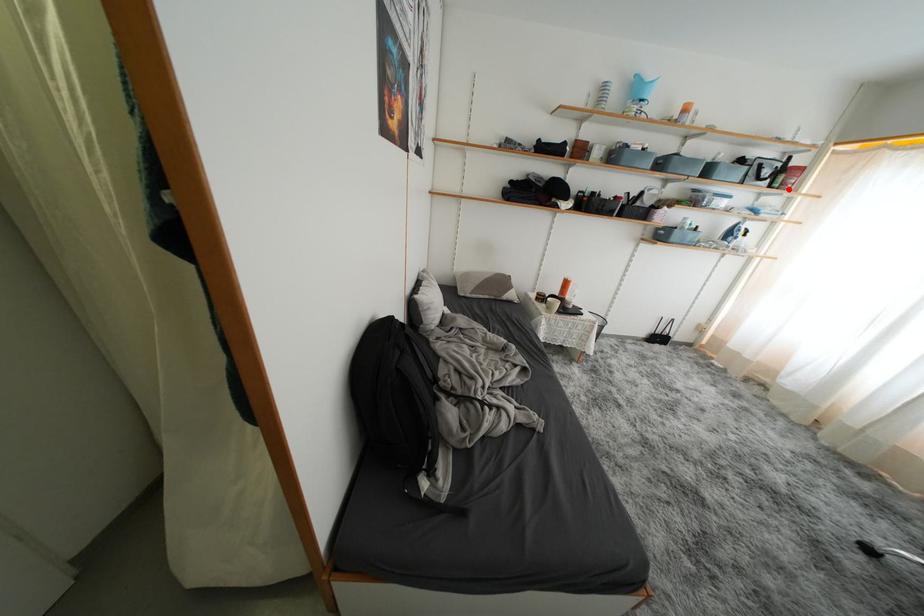
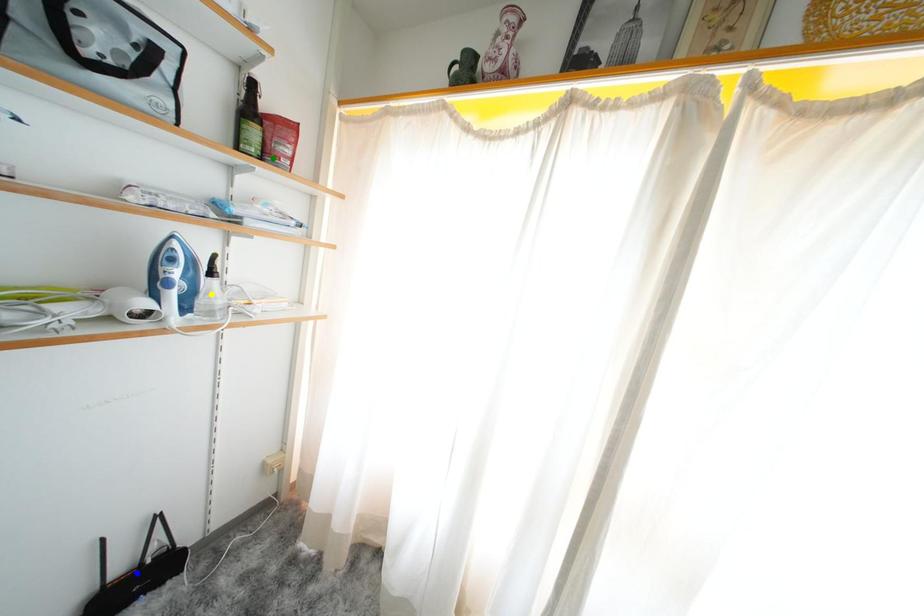
Question: I am providing you with two images of the same scene from different viewpoints. A red point is marked on the first image. You are given multiple points on the second image. In image 2, which mark is for the same physical point as the one in image 1?

Choices:
 (A) yellow point
 (B) blue point
 (C) green point

Answer: (C)